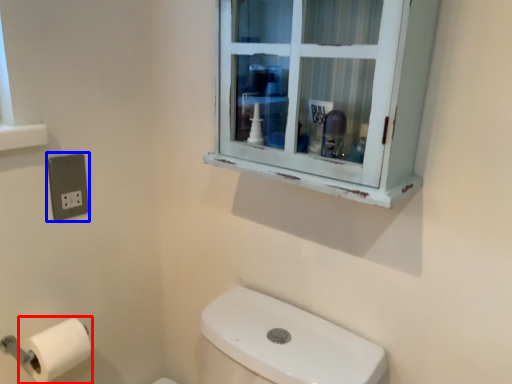
Question: Which object appears farthest to the camera in this image, toilet paper (highlighted by a red box) or electric outlet (highlighted by a blue box)?

Choices:
 (A) toilet paper
 (B) electric outlet

Answer: (B)